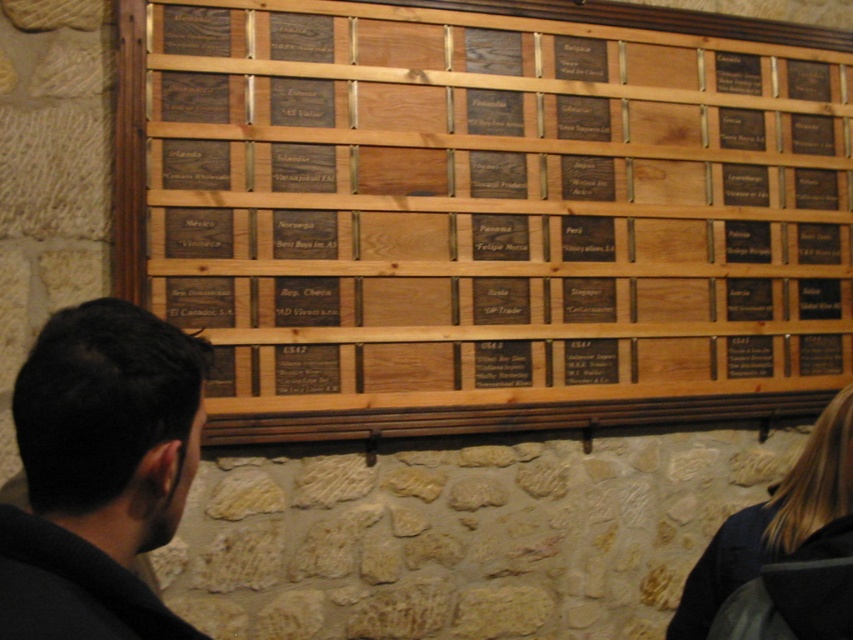
Is point (546, 280) positioned behind point (105, 532)?

That is True.

Does black wood plaque at center have a larger size compared to dark brown hair at center?

Yes, black wood plaque at center is bigger than dark brown hair at center.

Which is in front, point (117, 99) or point (161, 609)?

Positioned in front is point (161, 609).

Identify the location of black wood plaque at center. Image resolution: width=853 pixels, height=640 pixels. (486, 212).

Is dark brown hair at center taller than blonde hair at lower right?

In fact, dark brown hair at center may be shorter than blonde hair at lower right.

Based on the photo, between dark brown hair at center and blonde hair at lower right, which one appears on the right side from the viewer's perspective?

From the viewer's perspective, blonde hair at lower right appears more on the right side.

Locate an element on the screen. The height and width of the screenshot is (640, 853). dark brown hair at center is located at coordinates (99, 472).

Between point (309, 237) and point (808, 525), which one is positioned in front?

Point (808, 525) is in front.

How distant is black wood plaque at center from blonde hair at lower right?

A distance of 4.33 feet exists between black wood plaque at center and blonde hair at lower right.

Locate an element on the screen. The image size is (853, 640). black wood plaque at center is located at coordinates (486, 212).